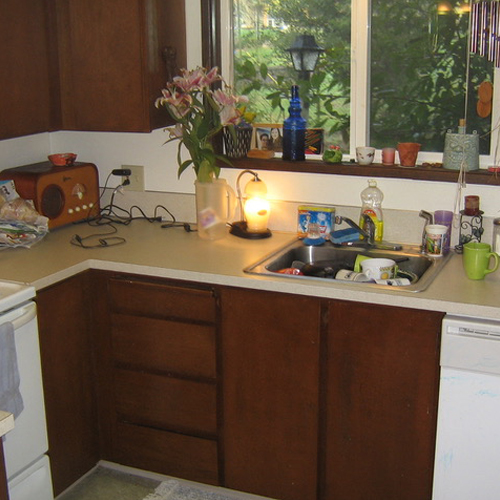
Locate an element on the screen. The image size is (500, 500). stove top is located at coordinates (6, 289).